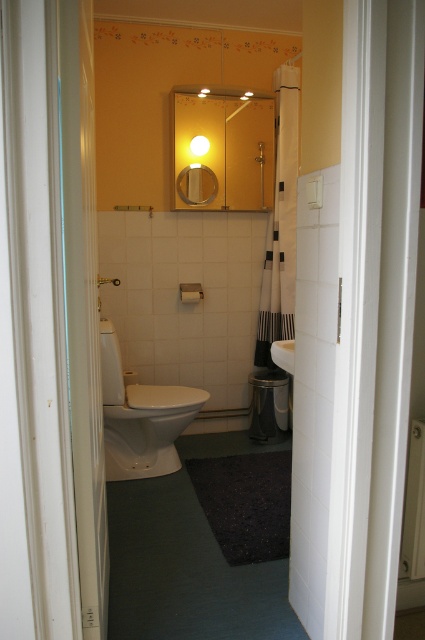
Question: Which point appears closest to the camera in this image?

Choices:
 (A) (282, 358)
 (B) (197, 134)
 (C) (136, 452)
 (D) (119, 280)

Answer: (A)

Question: Where is white glossy toilet at center located in relation to white glossy sink at center in the image?

Choices:
 (A) right
 (B) left

Answer: (B)

Question: Does white glossy lamp at upper center appear over matte white shower at center?

Choices:
 (A) yes
 (B) no

Answer: (A)

Question: Which object is closer to the camera taking this photo?

Choices:
 (A) white glossy toilet at center
 (B) matte white shower at center

Answer: (A)

Question: Can you confirm if white glossy toilet at center is wider than white glossy lamp at upper center?

Choices:
 (A) yes
 (B) no

Answer: (A)

Question: Which point is farther to the camera?

Choices:
 (A) (98, 285)
 (B) (277, 344)
 (C) (183, 403)
 (D) (198, 152)

Answer: (D)